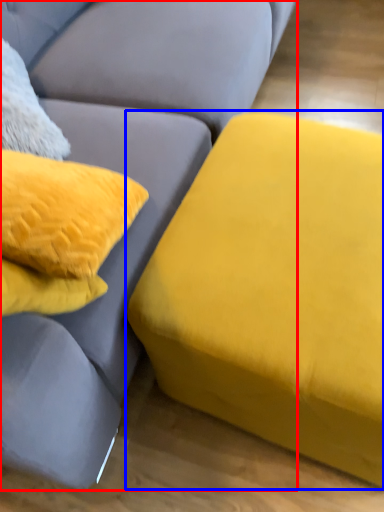
Question: Which of the following is the closest to the observer, studio couch (highlighted by a red box) or studio couch (highlighted by a blue box)?

Choices:
 (A) studio couch
 (B) studio couch

Answer: (A)